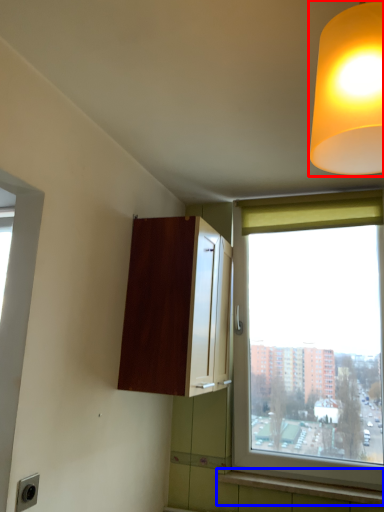
Question: Which object appears farthest to the camera in this image, lamp (highlighted by a red box) or window sill (highlighted by a blue box)?

Choices:
 (A) lamp
 (B) window sill

Answer: (B)